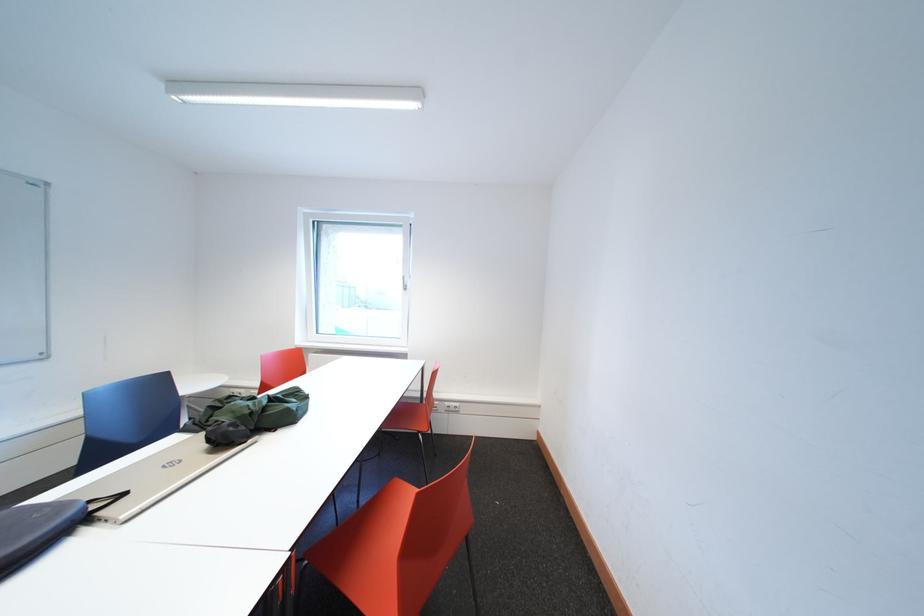
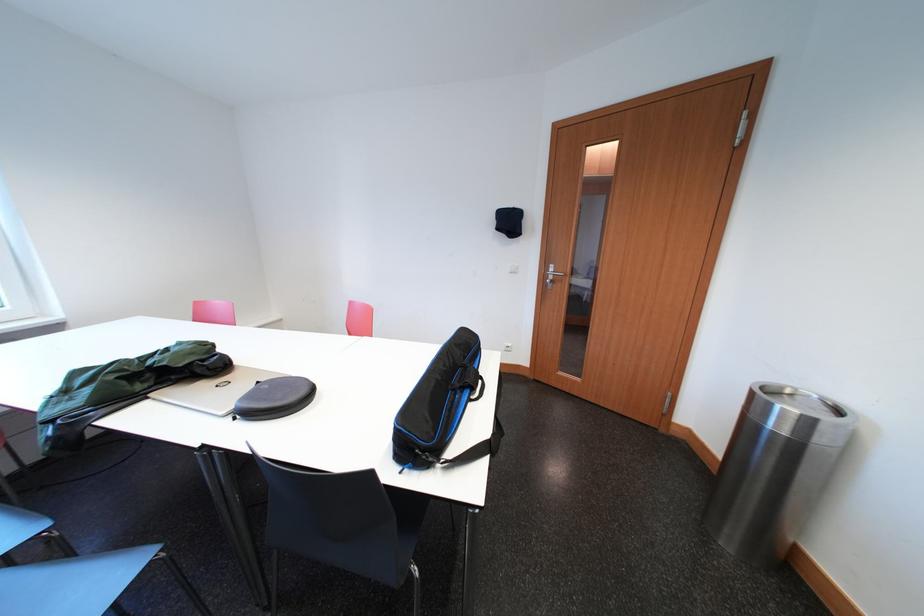
Where in the second image is the point corresponding to the point at 261,418 from the first image?

(223, 350)